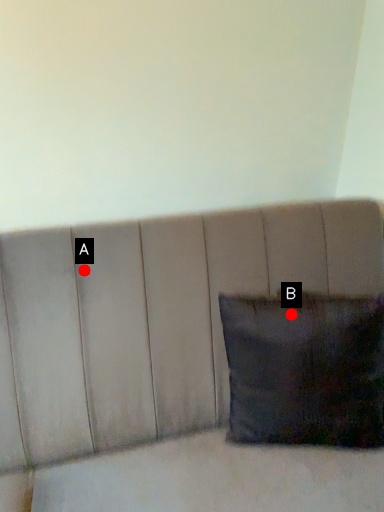
Question: Two points are circled on the image, labeled by A and B beside each circle. Among these points, which one is nearest to the camera?

Choices:
 (A) A is closer
 (B) B is closer

Answer: (B)